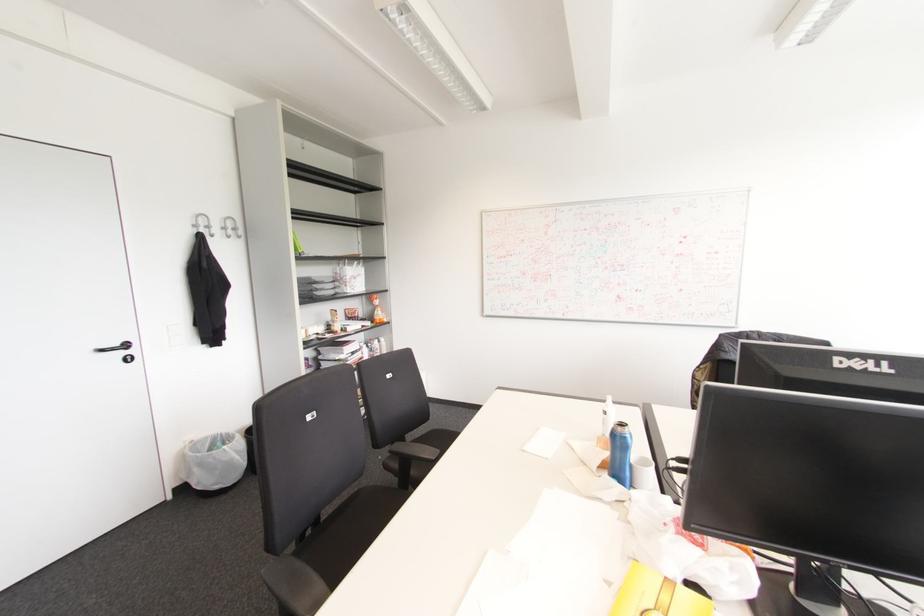
The width and height of the screenshot is (924, 616). Describe the element at coordinates (118, 351) in the screenshot. I see `the black door handle` at that location.